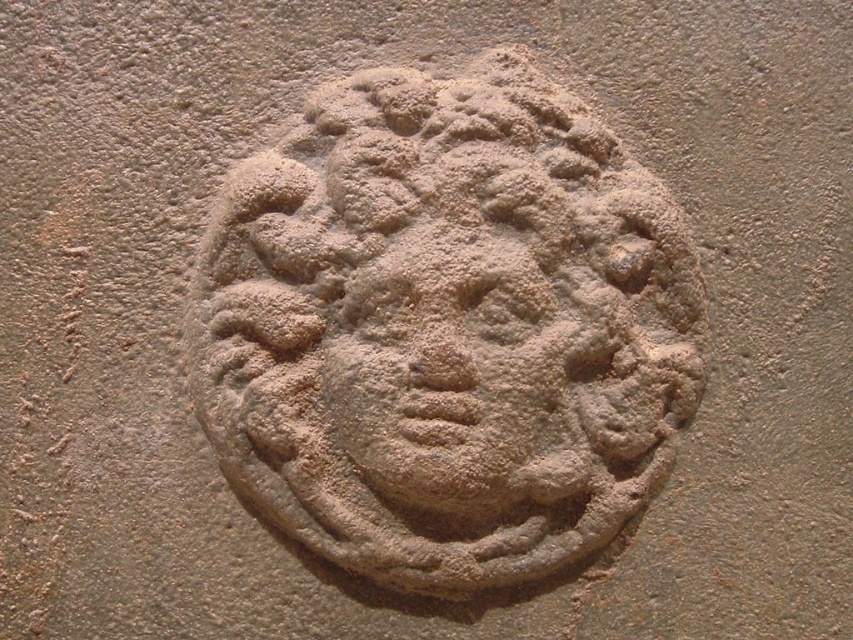
Question: Which of the following is the closest to the observer?

Choices:
 (A) matte stone face at center
 (B) matte sandstone face at center

Answer: (A)

Question: Considering the relative positions of matte sandstone face at center and matte stone face at center in the image provided, where is matte sandstone face at center located with respect to matte stone face at center?

Choices:
 (A) below
 (B) above

Answer: (B)

Question: Can you confirm if matte sandstone face at center is thinner than matte stone face at center?

Choices:
 (A) no
 (B) yes

Answer: (A)

Question: Which point is farther from the camera taking this photo?

Choices:
 (A) (473, 371)
 (B) (599, 435)

Answer: (B)

Question: Does matte sandstone face at center appear over matte stone face at center?

Choices:
 (A) yes
 (B) no

Answer: (A)

Question: Which point is closer to the camera?

Choices:
 (A) coord(531,268)
 (B) coord(575,428)

Answer: (A)